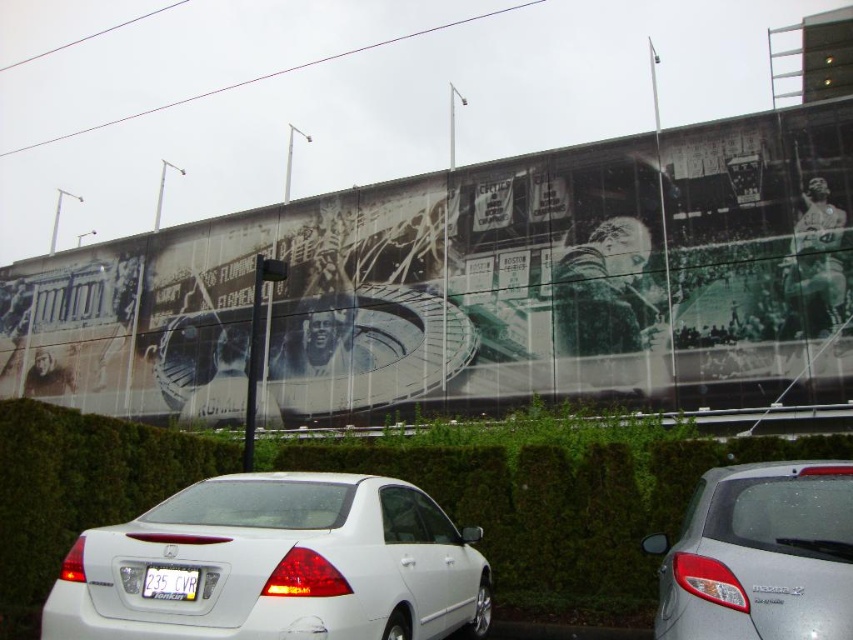
You are standing in front of the wall with the mural. There are two points marked on the wall at coordinates point(x=767, y=480) and point(x=180, y=595). If you want to touch both points starting from the nearest one, which point should you touch first?

You should touch point(x=767, y=480) first because it is closer to you than point(x=180, y=595).

You are standing in front of the wall with the mural and notice two points marked on it. The first point is at coordinates point (73, 392) and the second is at point (778, 468). If you want to touch both points starting from the one closer to you, which point should you touch first?

You should touch point (73, 392) first because it is closer to you than point (778, 468).

Based on the photo, you are a delivery driver who needs to park your truck next to the silver metallic hatchback at center and the white plastic license plate at center. Considering the space between them, will your truck fit between them?

The silver metallic hatchback at center is larger than the white plastic license plate at center, so there might be enough space for the truck between them. However, without knowing the exact dimensions of the truck and the distance between the two objects, it is difficult to determine if it will fit. Please measure the space before attempting to park.